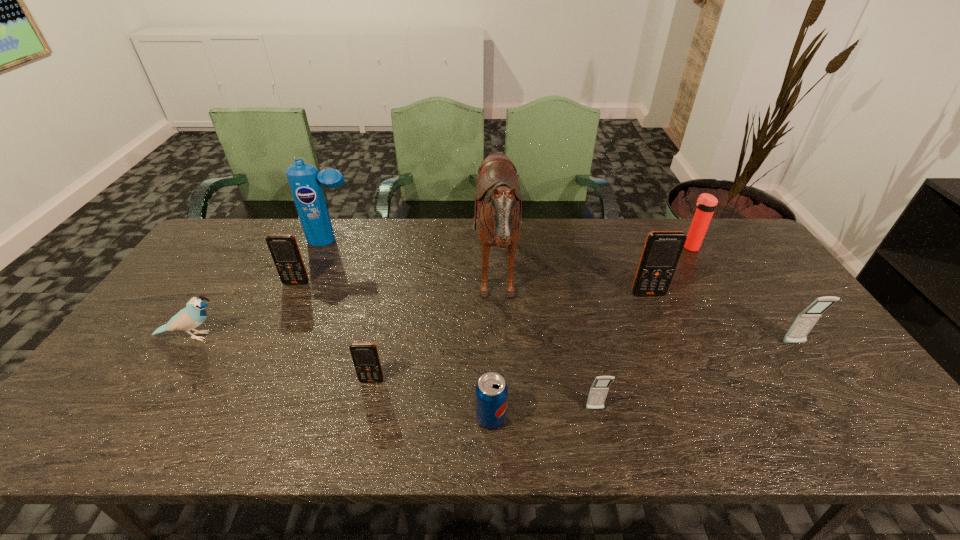
Where is `vacant region located on the right of the shampoo`? Image resolution: width=960 pixels, height=540 pixels. vacant region located on the right of the shampoo is located at coordinates tap(372, 241).

This screenshot has width=960, height=540. Identify the location of vacant area situated on the screen of the second cellular telephone from right to left. (699, 415).

This screenshot has height=540, width=960. I want to click on free location located 0.280m on the front of the thermos bottle, so click(729, 313).

You are a GUI agent. You are given a task and a screenshot of the screen. Output one action in this format:
    pyautogui.click(x=<x>, y=<y>)
    Task: Click on the free location located on the front-facing side of the rightmost cellular telephone
    The height and width of the screenshot is (540, 960).
    Given the screenshot: What is the action you would take?
    click(x=847, y=419)

I want to click on blank area located on the screen of the farthest cellular telephone, so click(x=245, y=393).

Where is `free space located at the face of the bird`? free space located at the face of the bird is located at coordinates point(247,336).

Locate an element on the screen. The image size is (960, 540). vacant space located 0.060m on the screen of the nearest orange cellular telephone is located at coordinates (367, 405).

You are a GUI agent. You are given a task and a screenshot of the screen. Output one action in this format:
    pyautogui.click(x=<x>, y=<y>)
    Task: Click on the vacant space located on the back of the pop soda
    
    Given the screenshot: What is the action you would take?
    pyautogui.click(x=489, y=298)

Locate an element on the screen. saddle at the far edge is located at coordinates (498, 201).

The image size is (960, 540). In order to click on shampoo at the far edge in this screenshot , I will do `click(304, 180)`.